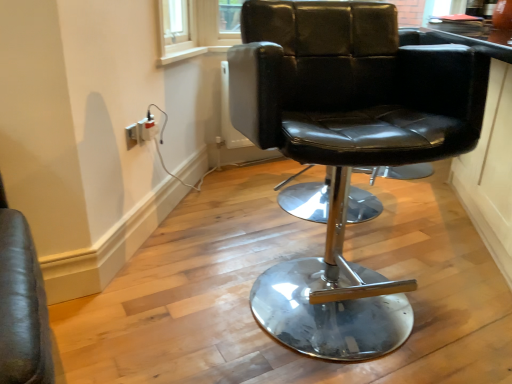
The height and width of the screenshot is (384, 512). What do you see at coordinates (148, 128) in the screenshot?
I see `white plastic socket at lower left, the 1th electric outlet in the right-to-left sequence` at bounding box center [148, 128].

Describe the element at coordinates (132, 135) in the screenshot. I see `white plastic electric outlet at lower left, the 1th electric outlet from the front` at that location.

Locate an element on the screen. The width and height of the screenshot is (512, 384). white plastic socket at lower left, acting as the 2th electric outlet starting from the front is located at coordinates (148, 128).

Can you confirm if black leather chair at center is bigger than white plastic electric outlet at lower left, the first electric outlet viewed from the left?

Correct, black leather chair at center is larger in size than white plastic electric outlet at lower left, the first electric outlet viewed from the left.

Can you tell me how much black leather chair at center and white plastic electric outlet at lower left, placed as the 2th electric outlet when sorted from right to left, differ in facing direction?

70.6 degrees.

Is point (345, 30) less distant than point (132, 141)?

Yes.

Which object is closer to the camera taking this photo, black leather chair at center or white plastic electric outlet at lower left, the 2th electric outlet viewed from the back?

black leather chair at center is closer to the camera.

This screenshot has height=384, width=512. I want to click on chair in front of the white plastic socket at lower left, positioned as the second electric outlet in left-to-right order, so click(346, 149).

Is white plastic socket at lower left, positioned as the second electric outlet in left-to-right order, outside of black leather chair at center?

Indeed, white plastic socket at lower left, positioned as the second electric outlet in left-to-right order, is completely outside black leather chair at center.

Who is smaller, white plastic socket at lower left, positioned as the second electric outlet in left-to-right order, or black leather chair at center?

white plastic socket at lower left, positioned as the second electric outlet in left-to-right order, is smaller.

Is white plastic electric outlet at lower left, placed as the 2th electric outlet when sorted from right to left, oriented away from black leather chair at center?

white plastic electric outlet at lower left, placed as the 2th electric outlet when sorted from right to left, is not turned away from black leather chair at center.

Considering the positions of objects white plastic electric outlet at lower left, the 1th electric outlet from the front, and black leather chair at center in the image provided, who is more to the left, white plastic electric outlet at lower left, the 1th electric outlet from the front, or black leather chair at center?

From the viewer's perspective, white plastic electric outlet at lower left, the 1th electric outlet from the front, appears more on the left side.

Does white plastic electric outlet at lower left, the 2th electric outlet viewed from the back, have a smaller size compared to black leather chair at center?

Yes, white plastic electric outlet at lower left, the 2th electric outlet viewed from the back, is smaller than black leather chair at center.

Considering the relative sizes of black leather chair at center and white plastic socket at lower left, acting as the 2th electric outlet starting from the front, in the image provided, is black leather chair at center wider than white plastic socket at lower left, acting as the 2th electric outlet starting from the front,?

Yes, black leather chair at center is wider than white plastic socket at lower left, acting as the 2th electric outlet starting from the front.

Considering the relative positions of black leather chair at center and white plastic socket at lower left, the 1th electric outlet from the back, in the image provided, is black leather chair at center to the right of white plastic socket at lower left, the 1th electric outlet from the back, from the viewer's perspective?

Yes.

Consider the image. Is the surface of black leather chair at center in direct contact with white plastic socket at lower left, acting as the 2th electric outlet starting from the front?

No.

From the image's perspective, which one is positioned lower, black leather chair at center or white plastic socket at lower left, positioned as the second electric outlet in left-to-right order?

black leather chair at center.

Is point (137, 139) positioned behind point (145, 121)?

No, it is not.

How many degrees apart are the facing directions of white plastic electric outlet at lower left, the 1th electric outlet from the front, and white plastic socket at lower left, the 1th electric outlet in the right-to-left sequence?

They differ by 0.00329 degrees in their facing directions.

Is white plastic electric outlet at lower left, placed as the 2th electric outlet when sorted from right to left, inside the boundaries of white plastic socket at lower left, acting as the 2th electric outlet starting from the front, or outside?

white plastic electric outlet at lower left, placed as the 2th electric outlet when sorted from right to left, is located beyond the bounds of white plastic socket at lower left, acting as the 2th electric outlet starting from the front.

The height and width of the screenshot is (384, 512). I want to click on electric outlet above the white plastic electric outlet at lower left, the 2th electric outlet viewed from the back (from the image's perspective), so click(148, 128).

Considering the positions of point (152, 127) and point (135, 140), is point (152, 127) closer or farther from the camera than point (135, 140)?

Point (152, 127).

Between white plastic socket at lower left, positioned as the second electric outlet in left-to-right order, and white plastic electric outlet at lower left, the 1th electric outlet from the front, which one has more height?

Standing taller between the two is white plastic electric outlet at lower left, the 1th electric outlet from the front.

Is white plastic socket at lower left, acting as the 2th electric outlet starting from the front, looking in the opposite direction of white plastic electric outlet at lower left, placed as the 2th electric outlet when sorted from right to left?

white plastic socket at lower left, acting as the 2th electric outlet starting from the front, is not turned away from white plastic electric outlet at lower left, placed as the 2th electric outlet when sorted from right to left.

What's the angular difference between white plastic socket at lower left, the 1th electric outlet in the right-to-left sequence, and white plastic electric outlet at lower left, the 1th electric outlet from the front,'s facing directions?

white plastic socket at lower left, the 1th electric outlet in the right-to-left sequence, and white plastic electric outlet at lower left, the 1th electric outlet from the front, are facing 0.00329 degrees away from each other.

This screenshot has height=384, width=512. What are the coordinates of `chair below the white plastic electric outlet at lower left, placed as the 2th electric outlet when sorted from right to left (from the image's perspective)` in the screenshot? It's located at [346, 149].

I want to click on chair above the white plastic socket at lower left, the 1th electric outlet from the back (from a real-world perspective), so click(346, 149).

From the image, which object appears to be nearer to black leather chair at center, white plastic electric outlet at lower left, the 1th electric outlet from the front, or white plastic socket at lower left, the 1th electric outlet from the back?

white plastic electric outlet at lower left, the 1th electric outlet from the front, lies closer to black leather chair at center than the other object.

Considering their positions, is white plastic socket at lower left, the 1th electric outlet in the right-to-left sequence, positioned further to black leather chair at center than white plastic electric outlet at lower left, the first electric outlet viewed from the left?

Among the two, white plastic socket at lower left, the 1th electric outlet in the right-to-left sequence, is located further to black leather chair at center.

Considering their positions, is white plastic electric outlet at lower left, the 2th electric outlet viewed from the back, positioned further to white plastic socket at lower left, the 1th electric outlet in the right-to-left sequence, than black leather chair at center?

black leather chair at center.

Based on the photo, estimate the real-world distances between objects in this image. Which object is closer to white plastic electric outlet at lower left, the first electric outlet viewed from the left, white plastic socket at lower left, the 1th electric outlet from the back, or black leather chair at center?

The object closer to white plastic electric outlet at lower left, the first electric outlet viewed from the left, is white plastic socket at lower left, the 1th electric outlet from the back.

Estimate the real-world distances between objects in this image. Which object is closer to white plastic electric outlet at lower left, the first electric outlet viewed from the left, black leather chair at center or white plastic socket at lower left, acting as the 2th electric outlet starting from the front?

white plastic socket at lower left, acting as the 2th electric outlet starting from the front, lies closer to white plastic electric outlet at lower left, the first electric outlet viewed from the left, than the other object.

When comparing their distances from white plastic socket at lower left, the 1th electric outlet from the back, does black leather chair at center or white plastic electric outlet at lower left, the first electric outlet viewed from the left, seem closer?

white plastic electric outlet at lower left, the first electric outlet viewed from the left, is positioned closer to the anchor white plastic socket at lower left, the 1th electric outlet from the back.

Locate an element on the screen. Image resolution: width=512 pixels, height=384 pixels. electric outlet located between black leather chair at center and white plastic socket at lower left, the 1th electric outlet from the back, in the depth direction is located at coordinates (132, 135).